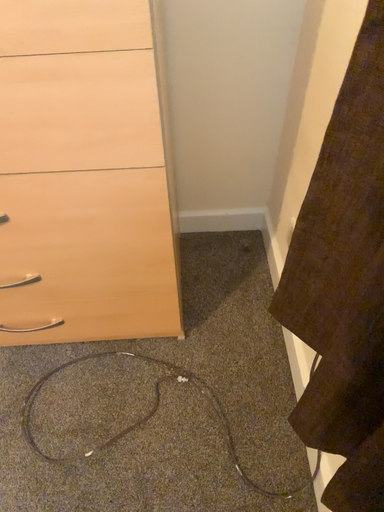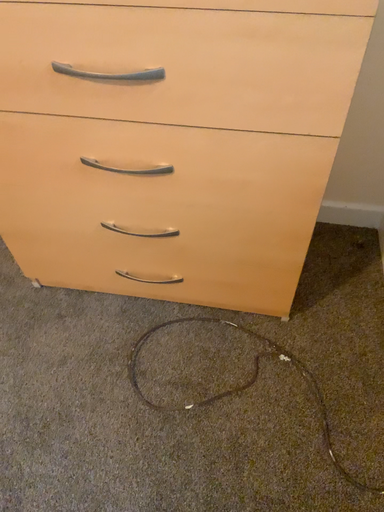
Question: Which way did the camera rotate in the video?

Choices:
 (A) rotated left
 (B) rotated right

Answer: (A)